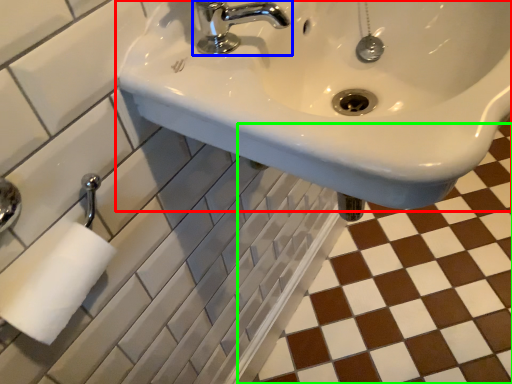
Question: Estimate the real-world distances between objects in this image. Which object is farther from sink (highlighted by a red box), tap (highlighted by a blue box) or ceramic tile (highlighted by a green box)?

Choices:
 (A) tap
 (B) ceramic tile

Answer: (B)